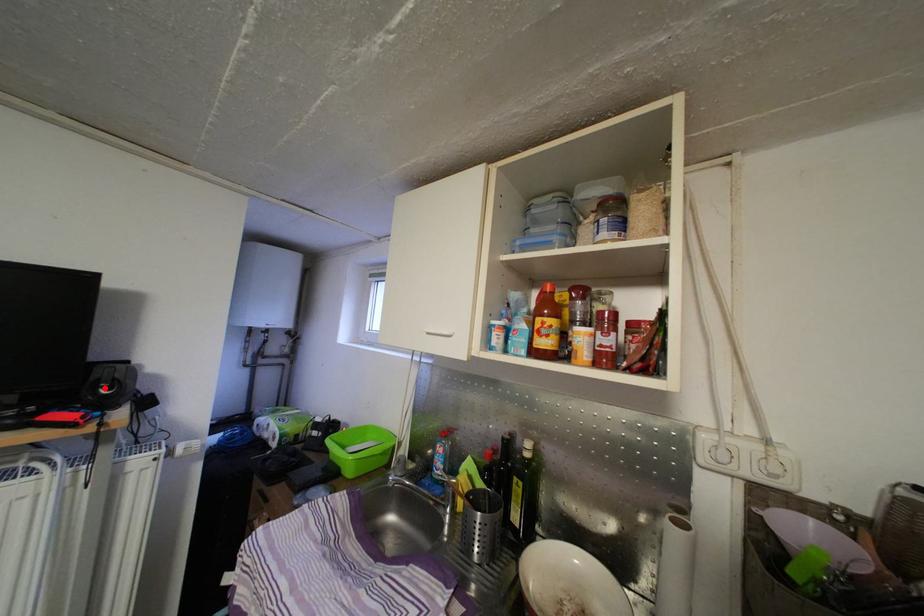
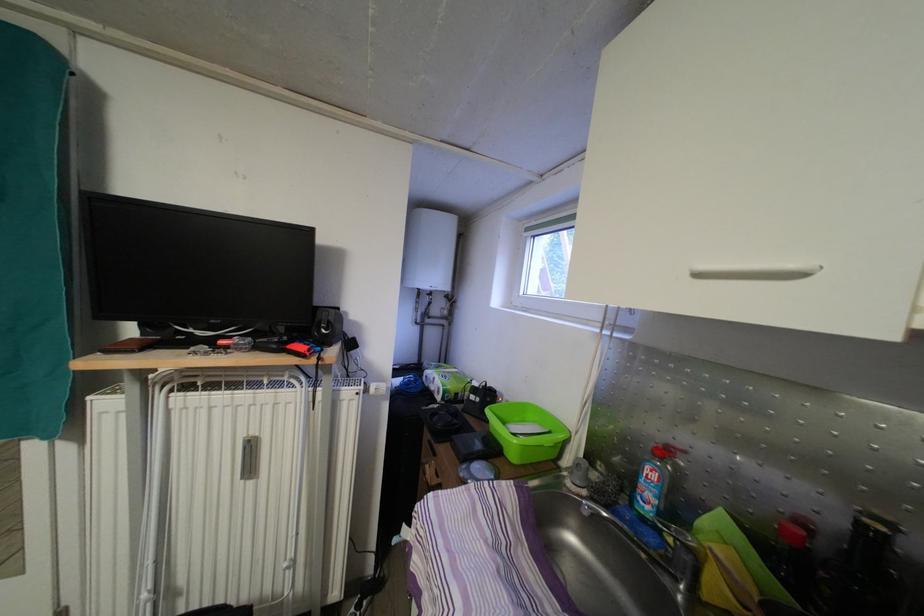
Where in the second image is the point corresponding to the highlighted location from the first image?

(326, 329)